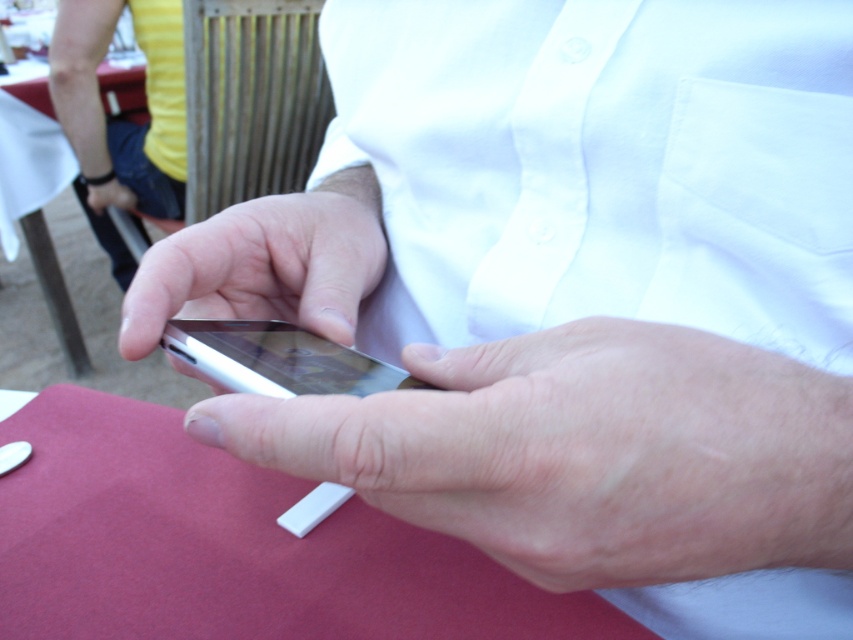
Question: Is white glossy smartphone at center to the right of smooth red table at lower left from the viewer's perspective?

Choices:
 (A) yes
 (B) no

Answer: (A)

Question: Which point is closer to the camera taking this photo?

Choices:
 (A) (160, 264)
 (B) (129, 454)
 (C) (131, 202)
 (D) (724, 451)

Answer: (D)

Question: From the image, what is the correct spatial relationship of silver metallic phone at center in relation to white glossy smartphone at center?

Choices:
 (A) right
 (B) left

Answer: (A)

Question: Which point is farther from the camera taking this photo?

Choices:
 (A) (309, 333)
 (B) (102, 202)

Answer: (B)

Question: Which of the following is the farthest from the observer?

Choices:
 (A) coord(91,193)
 (B) coord(404,372)

Answer: (A)

Question: Is smooth red table at lower left closer to the viewer compared to matte black phone at center?

Choices:
 (A) no
 (B) yes

Answer: (A)